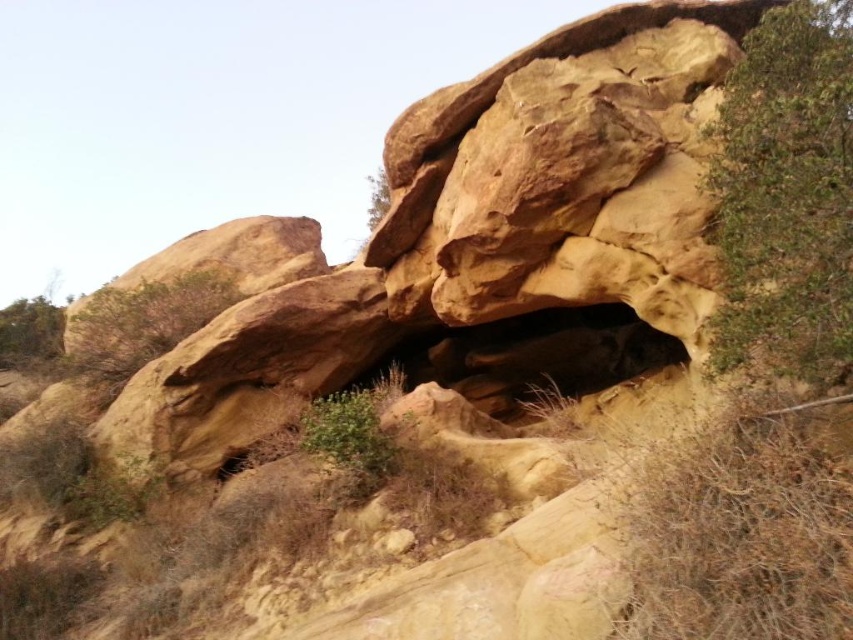
You are standing in front of the rock formation and see the green leafy tree at left and the green leafy tree at upper center. Which tree is located to the right of the other?

The green leafy tree at left is positioned on the left side of green leafy tree at upper center, so the green leafy tree at upper center is to the right of the green leafy tree at left.

You are standing at the center of the image and want to locate the green leafy shrub at upper right. According to the coordinates provided, in which direction should you look?

The green leafy shrub at upper right is located at point (787, 196), which means you should look towards the upper right direction to find it.

You are standing at the base of the largest rock formation in the center right of the image. Looking towards the upper right, you see the green leafy shrub at upper right and the green leafy tree at left. Which of these two plants is closer to your current position?

The green leafy shrub at upper right is positioned over the green leafy tree at left, meaning it is closer to your current position at the base of the largest rock formation.